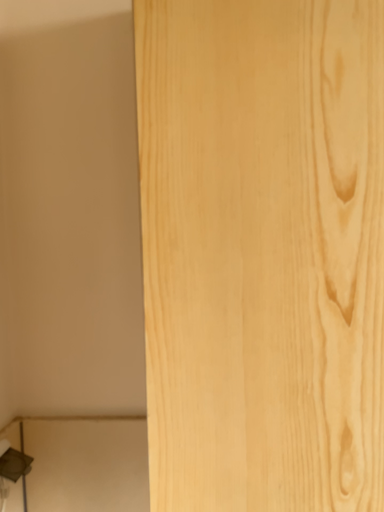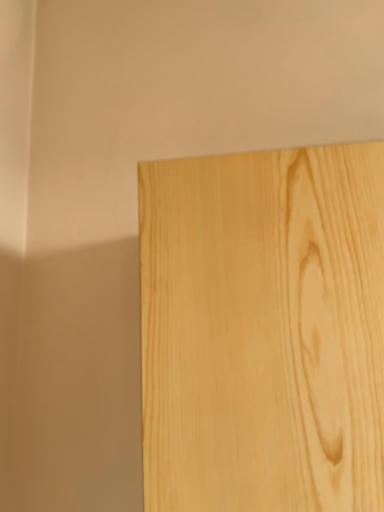
Question: How did the camera likely rotate when shooting the video?

Choices:
 (A) rotated upward
 (B) rotated downward

Answer: (A)